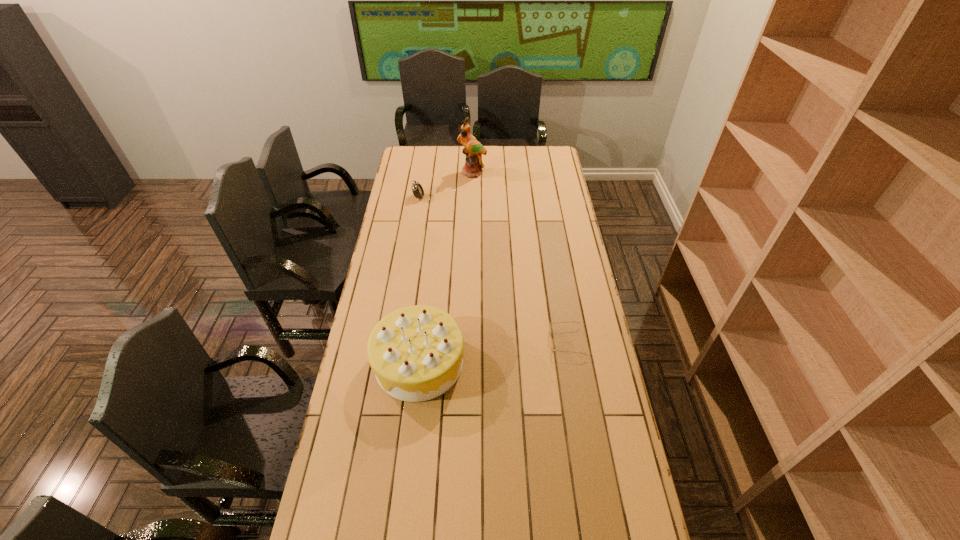
What are the coordinates of `free space located 0.150m on the temples of the shortest object` in the screenshot? It's located at (509, 341).

Locate an element on the screen. This screenshot has height=540, width=960. free space located 0.190m on the temples of the shortest object is located at coordinates (498, 341).

What are the coordinates of `vacant space located on the temples of the shortest object` in the screenshot? It's located at (452, 341).

The height and width of the screenshot is (540, 960). Find the location of `object that is at the far edge`. object that is at the far edge is located at coordinates (473, 149).

You are a GUI agent. You are given a task and a screenshot of the screen. Output one action in this format:
    pyautogui.click(x=<x>, y=<y>)
    Task: Click on the birthday cake that is at the left edge
    
    Given the screenshot: What is the action you would take?
    pyautogui.click(x=416, y=353)

You are a GUI agent. You are given a task and a screenshot of the screen. Output one action in this format:
    pyautogui.click(x=<x>, y=<y>)
    Task: Click on the alarm clock located in the left edge section of the desktop
    
    Given the screenshot: What is the action you would take?
    pyautogui.click(x=417, y=189)

I want to click on object located at the right edge, so pos(550,326).

Find the location of a particular element. Image resolution: width=960 pixels, height=540 pixels. vacant space at the left edge of the desktop is located at coordinates pos(396,215).

Where is `vacant area at the right edge`? The width and height of the screenshot is (960, 540). vacant area at the right edge is located at coordinates (563, 377).

Image resolution: width=960 pixels, height=540 pixels. Find the location of `free region at the far left corner of the desktop`. free region at the far left corner of the desktop is located at coordinates (403, 166).